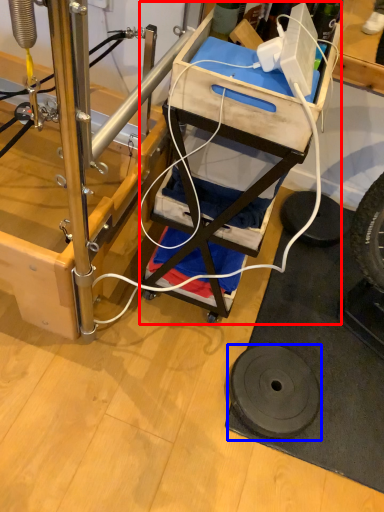
Question: Which of the following is the closest to the observer, furniture (highlighted by a red box) or wheel (highlighted by a blue box)?

Choices:
 (A) furniture
 (B) wheel

Answer: (A)